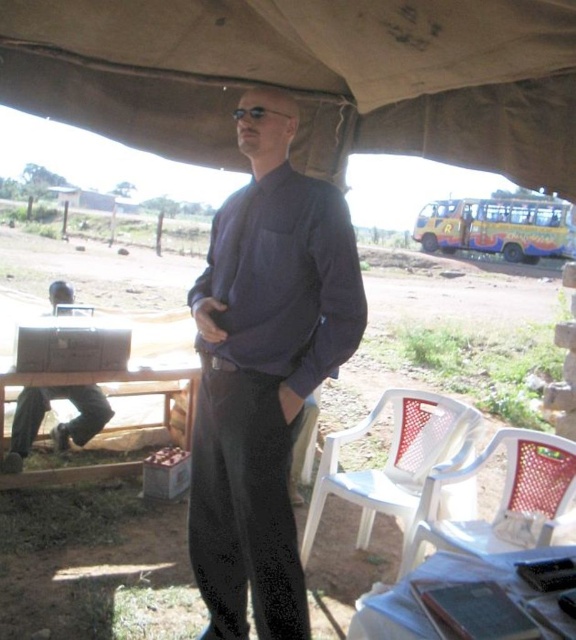
You are a photographer standing at the camera position. You want to take a photo of the brown canvas canopy at upper center. Can you reach it without moving your feet?

The brown canvas canopy at upper center is 1.68 meters away from camera, so yes, you can reach it without moving your feet since it is within a comfortable distance.

You are standing at the point marked as point (505, 499) in the image. What object is located at that exact point?

The white plastic chair at lower right is located at point (505, 499).

You are a visitor at this outdoor area and want to sit at the white plastic picnic table at lower right. From your current position under the brown canvas canopy at upper center, which direction should you head to reach it?

The white plastic picnic table at lower right is to the right of the brown canvas canopy at upper center, so you should head to the right to reach it.